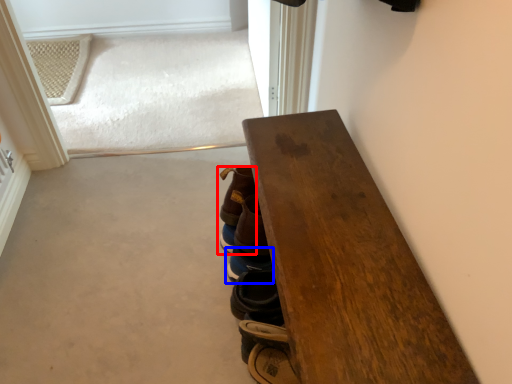
Question: Which object appears farthest to the camera in this image, footwear (highlighted by a red box) or footwear (highlighted by a blue box)?

Choices:
 (A) footwear
 (B) footwear

Answer: (B)